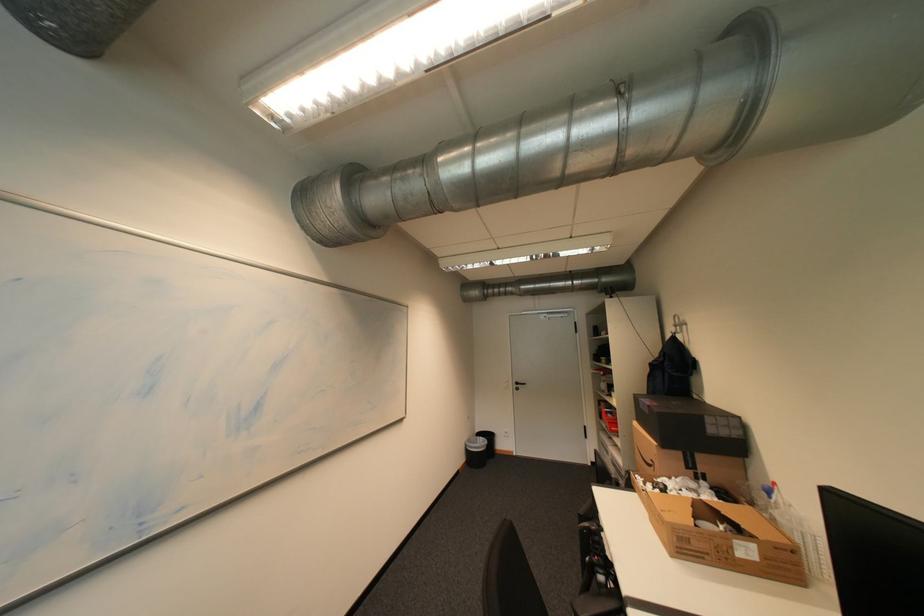
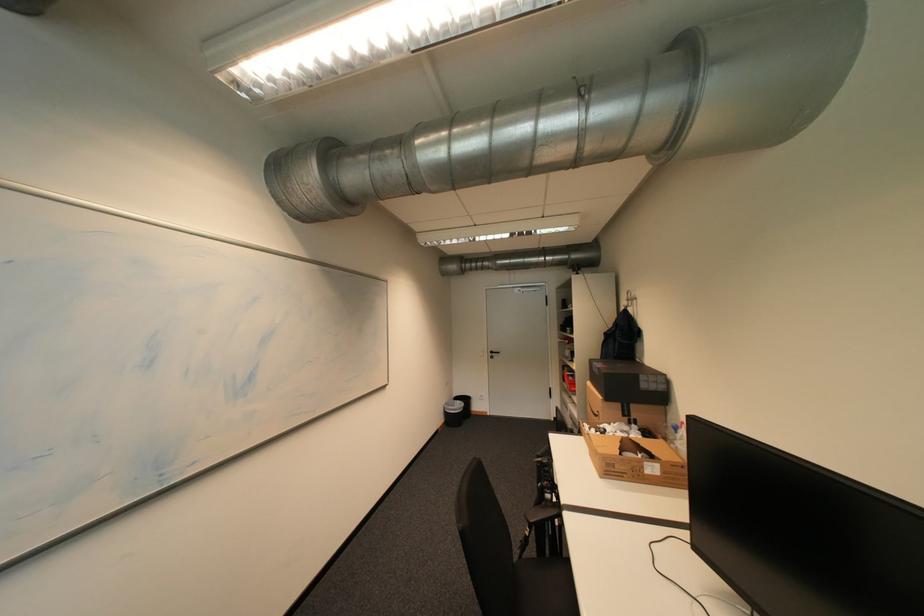
Question: The images are taken continuously from a first-person perspective. In which direction is your viewpoint rotating?

Choices:
 (A) Left
 (B) Right
 (C) Up
 (D) Down

Answer: (D)